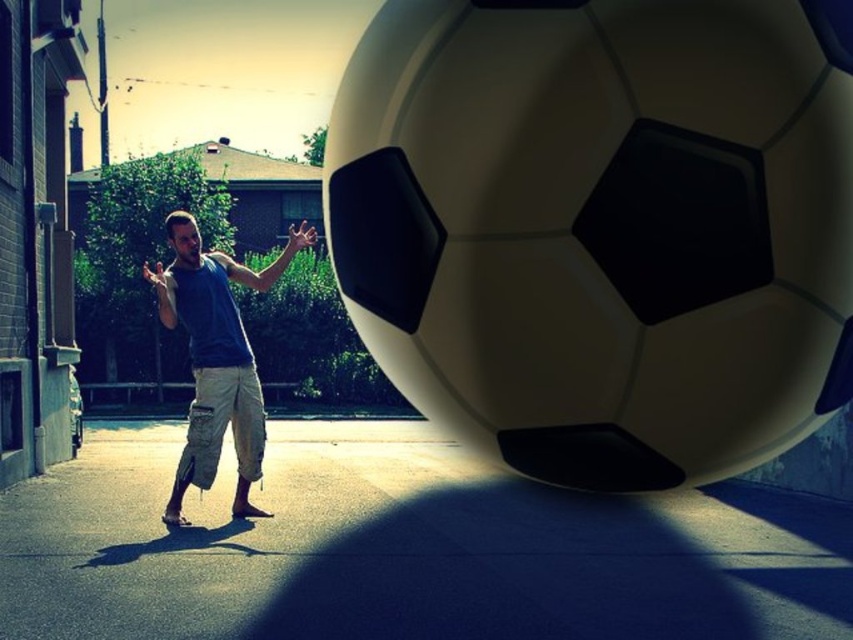
Describe the element at coordinates (404, 548) in the screenshot. I see `smooth concrete pavement at lower center` at that location.

Is point (199, 577) closer to camera compared to point (257, 385)?

Yes, it is.

Locate an element on the screen. smooth concrete pavement at lower center is located at coordinates (404, 548).

Where is `smooth concrete pavement at lower center`? smooth concrete pavement at lower center is located at coordinates (404, 548).